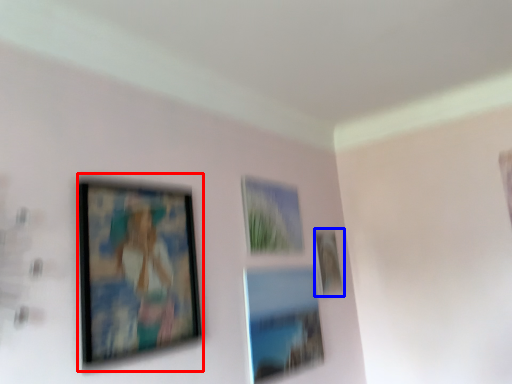
Question: Which object appears farthest to the camera in this image, picture frame (highlighted by a red box) or picture frame (highlighted by a blue box)?

Choices:
 (A) picture frame
 (B) picture frame

Answer: (B)